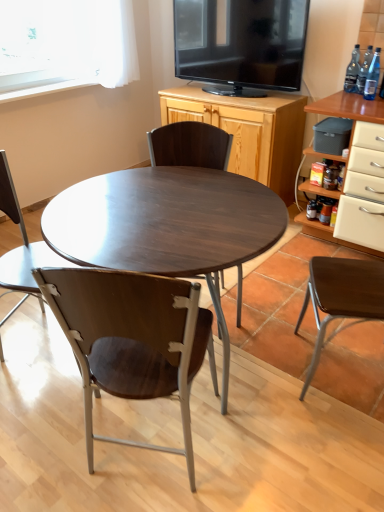
Image resolution: width=384 pixels, height=512 pixels. Identify the location of vacant space behind brown wood chair at right, acting as the fourth chair starting from the left. (303, 314).